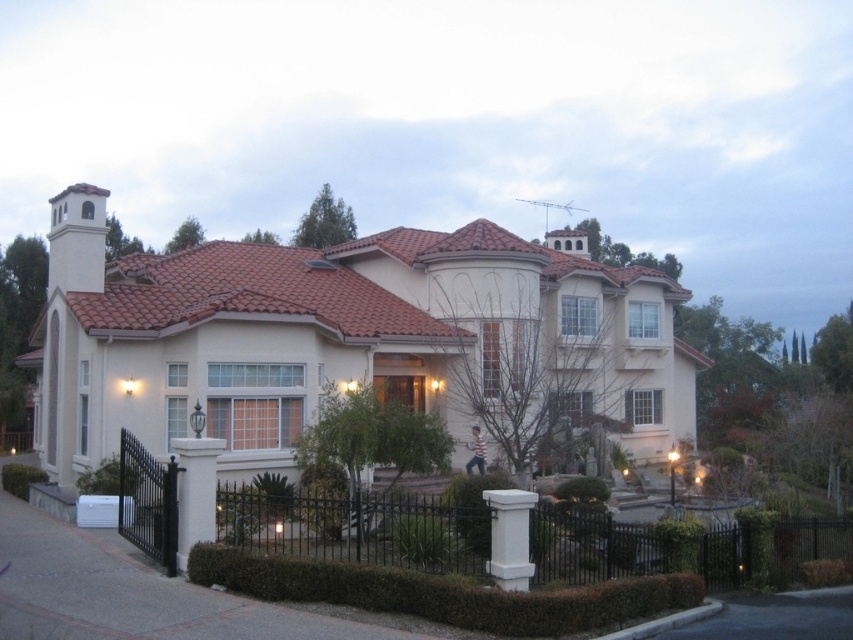
Question: Considering the relative positions of black wrought iron fence at lower left and white stone column at center in the image provided, where is black wrought iron fence at lower left located with respect to white stone column at center?

Choices:
 (A) below
 (B) above

Answer: (A)

Question: Is white stucco mansion at center positioned at the back of white stone column at center?

Choices:
 (A) no
 (B) yes

Answer: (B)

Question: Among these objects, which one is farthest from the camera?

Choices:
 (A) white stone column at center
 (B) black wrought iron fence at lower left
 (C) white stone pillar at lower left

Answer: (B)

Question: Among these objects, which one is farthest from the camera?

Choices:
 (A) white stone pillar at lower left
 (B) white stucco mansion at center
 (C) black wrought iron fence at lower left

Answer: (B)

Question: Which of these objects is positioned farthest from the white stone column at center?

Choices:
 (A) white stucco mansion at center
 (B) white stone pillar at lower left
 (C) black wrought iron fence at lower left

Answer: (A)

Question: Is white stucco mansion at center above black wrought iron fence at lower left?

Choices:
 (A) yes
 (B) no

Answer: (A)